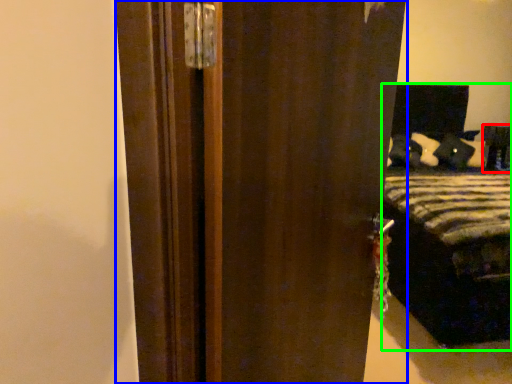
Question: Estimate the real-world distances between objects in this image. Which object is closer to furniture (highlighted by a red box), door (highlighted by a blue box) or bed (highlighted by a green box)?

Choices:
 (A) door
 (B) bed

Answer: (B)